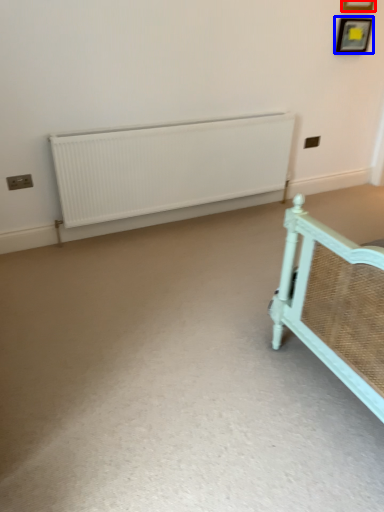
Question: Among these objects, which one is farthest to the camera, picture frame (highlighted by a red box) or picture frame (highlighted by a blue box)?

Choices:
 (A) picture frame
 (B) picture frame

Answer: (B)